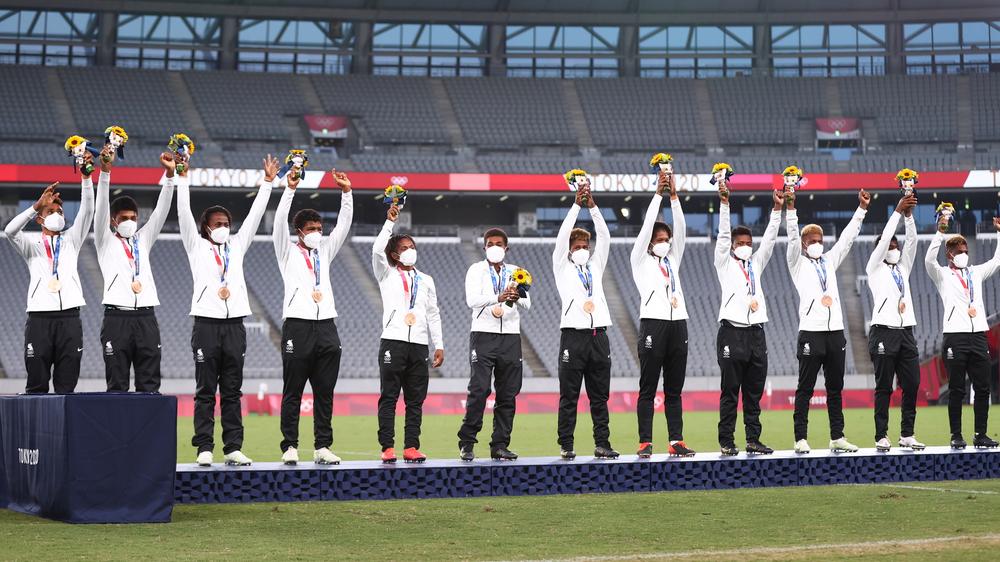
Locate an element on the screen. seats is located at coordinates (473, 94).